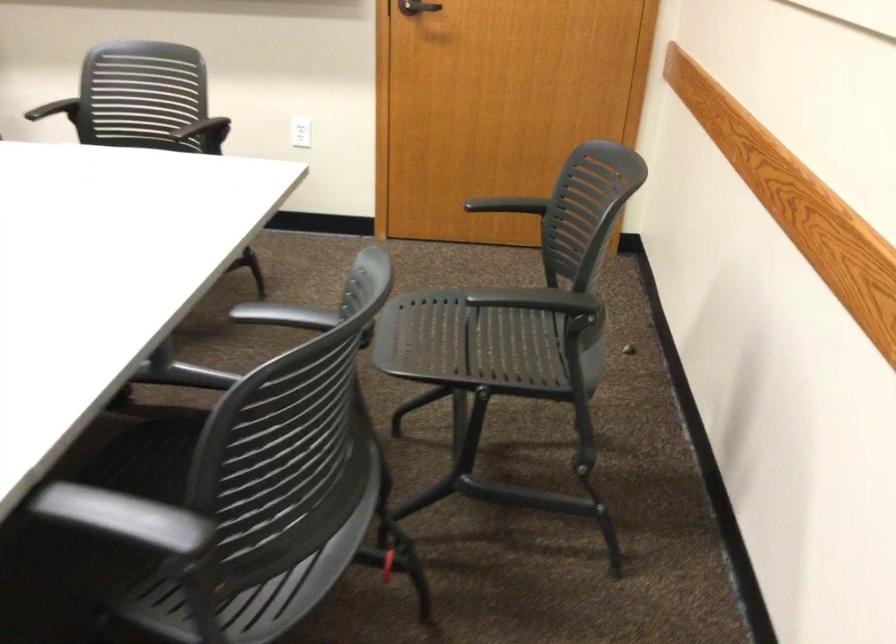
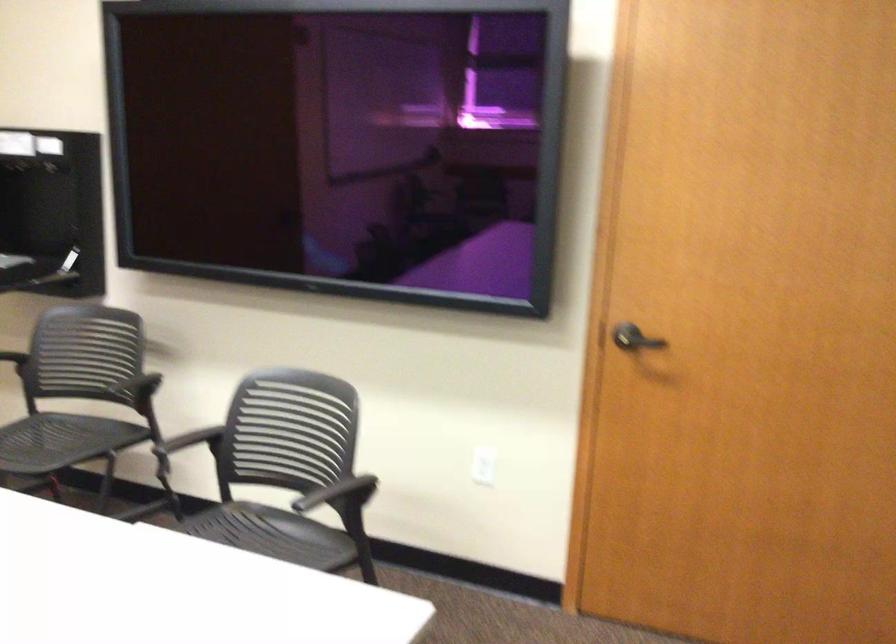
Find the pixel in the second image that matches (202,129) in the first image.

(337, 493)